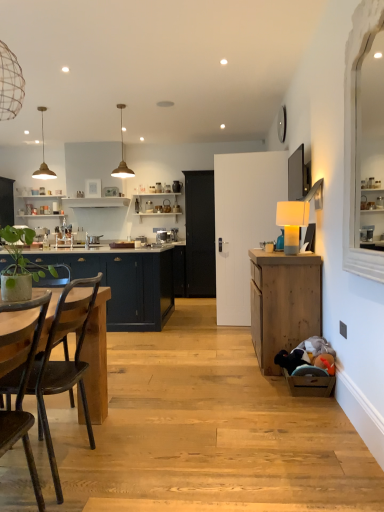
Question: Does rustic wood chair at left turn towards green matte plant at left?

Choices:
 (A) yes
 (B) no

Answer: (B)

Question: From the image's perspective, is rustic wood chair at left below green matte plant at left?

Choices:
 (A) yes
 (B) no

Answer: (A)

Question: From a real-world perspective, is rustic wood chair at left positioned over green matte plant at left based on gravity?

Choices:
 (A) yes
 (B) no

Answer: (B)

Question: Are rustic wood chair at left and green matte plant at left making contact?

Choices:
 (A) yes
 (B) no

Answer: (B)

Question: From the image's perspective, is rustic wood chair at left on top of green matte plant at left?

Choices:
 (A) yes
 (B) no

Answer: (B)

Question: Does rustic wood chair at left have a greater height compared to green matte plant at left?

Choices:
 (A) yes
 (B) no

Answer: (A)

Question: Considering the relative sizes of wooden cabinet at right, marked as the second cabinetry in a left-to-right arrangement, and satin silver toaster at center in the image provided, is wooden cabinet at right, marked as the second cabinetry in a left-to-right arrangement, smaller than satin silver toaster at center?

Choices:
 (A) yes
 (B) no

Answer: (B)

Question: Is wooden cabinet at right, arranged as the second cabinetry when viewed from the back, oriented away from satin silver toaster at center?

Choices:
 (A) no
 (B) yes

Answer: (A)

Question: Does wooden cabinet at right, which is the first cabinetry from right to left, have a lesser width compared to satin silver toaster at center?

Choices:
 (A) yes
 (B) no

Answer: (B)

Question: Is the position of wooden cabinet at right, marked as the second cabinetry in a left-to-right arrangement, less distant than that of satin silver toaster at center?

Choices:
 (A) yes
 (B) no

Answer: (A)

Question: From a real-world perspective, is wooden cabinet at right, which is the first cabinetry from right to left, located beneath satin silver toaster at center?

Choices:
 (A) no
 (B) yes

Answer: (B)

Question: Is wooden cabinet at right, arranged as the second cabinetry when viewed from the back, bigger than satin silver toaster at center?

Choices:
 (A) yes
 (B) no

Answer: (A)

Question: Is black matte door at center at the back of matte dark blue cabinets at left, which is the 2th cabinetry from front to back?

Choices:
 (A) yes
 (B) no

Answer: (A)